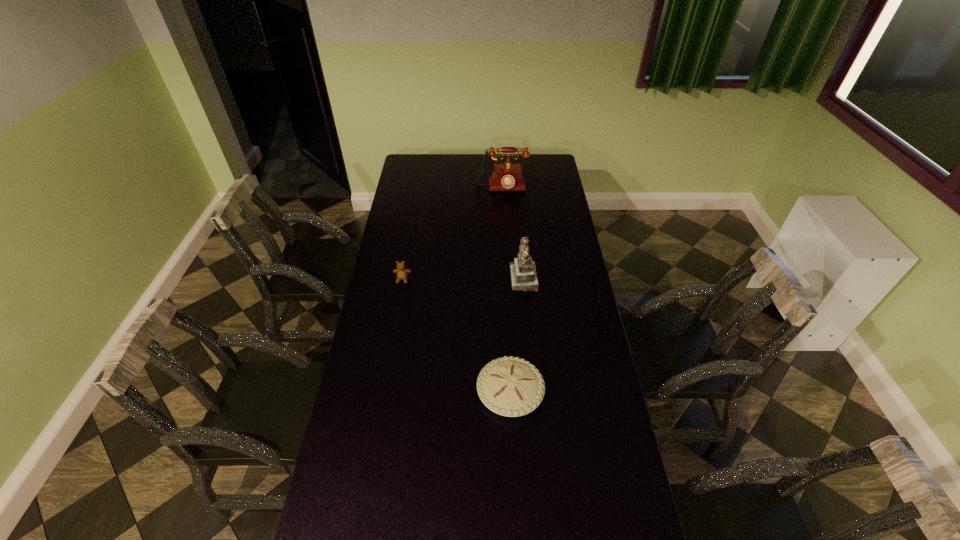
At what (x,y) coordinates should I click in order to perform the action: click on free region located 0.120m on the left of the pie. Please return your answer as a coordinate pair (x, y). This screenshot has height=540, width=960. Looking at the image, I should click on (443, 393).

At what (x,y) coordinates should I click in order to perform the action: click on object present at the left edge. Please return your answer as a coordinate pair (x, y). This screenshot has height=540, width=960. Looking at the image, I should click on (401, 272).

Where is `blank space at the far edge`? blank space at the far edge is located at coordinates (488, 173).

Locate an element on the screen. Image resolution: width=960 pixels, height=540 pixels. vacant space at the left edge of the desktop is located at coordinates (398, 323).

Identify the location of free space at the right edge. (x=582, y=435).

You are a GUI agent. You are given a task and a screenshot of the screen. Output one action in this format:
    pyautogui.click(x=<x>, y=<y>)
    Task: Click on the free space at the far right corner of the desktop
    Image resolution: width=960 pixels, height=540 pixels.
    Given the screenshot: What is the action you would take?
    pos(540,159)

I want to click on empty space that is in between the shortest object and the figurine, so click(x=517, y=336).

Image resolution: width=960 pixels, height=540 pixels. Identify the location of free spot between the figurine and the teddy bear. (463, 279).

In order to click on free area in between the teddy bear and the figurine in this screenshot , I will do `click(463, 279)`.

What are the coordinates of `vacant area that lies between the farthest object and the pie` in the screenshot? It's located at (506, 291).